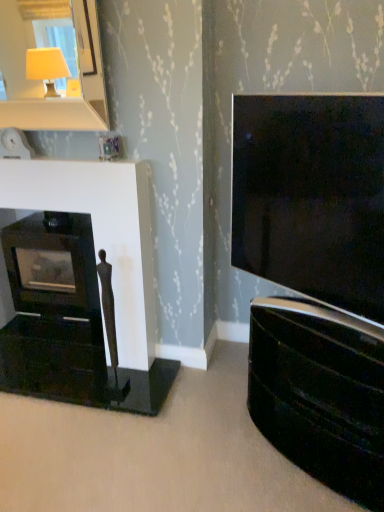
Question: Are matte black tv at right and white glossy mirror at upper left located far from each other?

Choices:
 (A) yes
 (B) no

Answer: (A)

Question: From the image's perspective, would you say matte black tv at right is shown under white glossy mirror at upper left?

Choices:
 (A) no
 (B) yes

Answer: (B)

Question: Considering the relative positions of matte black tv at right and white glossy mirror at upper left in the image provided, is matte black tv at right to the left of white glossy mirror at upper left from the viewer's perspective?

Choices:
 (A) yes
 (B) no

Answer: (B)

Question: From the image's perspective, is matte black tv at right located above white glossy mirror at upper left?

Choices:
 (A) no
 (B) yes

Answer: (A)

Question: From a real-world perspective, is matte black tv at right located beneath white glossy mirror at upper left?

Choices:
 (A) no
 (B) yes

Answer: (B)

Question: Looking at their shapes, would you say matte black fireplace at left is wider or thinner than white glossy mirror at upper left?

Choices:
 (A) thin
 (B) wide

Answer: (A)

Question: From the image's perspective, relative to white glossy mirror at upper left, is matte black fireplace at left above or below?

Choices:
 (A) below
 (B) above

Answer: (A)

Question: From their relative heights in the image, would you say matte black fireplace at left is taller or shorter than white glossy mirror at upper left?

Choices:
 (A) short
 (B) tall

Answer: (B)

Question: Is matte black fireplace at left inside the boundaries of white glossy mirror at upper left, or outside?

Choices:
 (A) inside
 (B) outside

Answer: (B)

Question: Is matte black tv at right taller or shorter than matte black fireplace at left?

Choices:
 (A) tall
 (B) short

Answer: (B)

Question: Is matte black tv at right wider or thinner than matte black fireplace at left?

Choices:
 (A) thin
 (B) wide

Answer: (B)

Question: Is matte black tv at right in front of or behind matte black fireplace at left in the image?

Choices:
 (A) front
 (B) behind

Answer: (A)

Question: Considering the positions of matte black tv at right and matte black fireplace at left in the image, is matte black tv at right bigger or smaller than matte black fireplace at left?

Choices:
 (A) big
 (B) small

Answer: (A)

Question: Considering the positions of point (100, 80) and point (153, 412), is point (100, 80) closer or farther from the camera than point (153, 412)?

Choices:
 (A) farther
 (B) closer

Answer: (B)

Question: From the image's perspective, is white glossy mirror at upper left above or below matte black fireplace at left?

Choices:
 (A) above
 (B) below

Answer: (A)